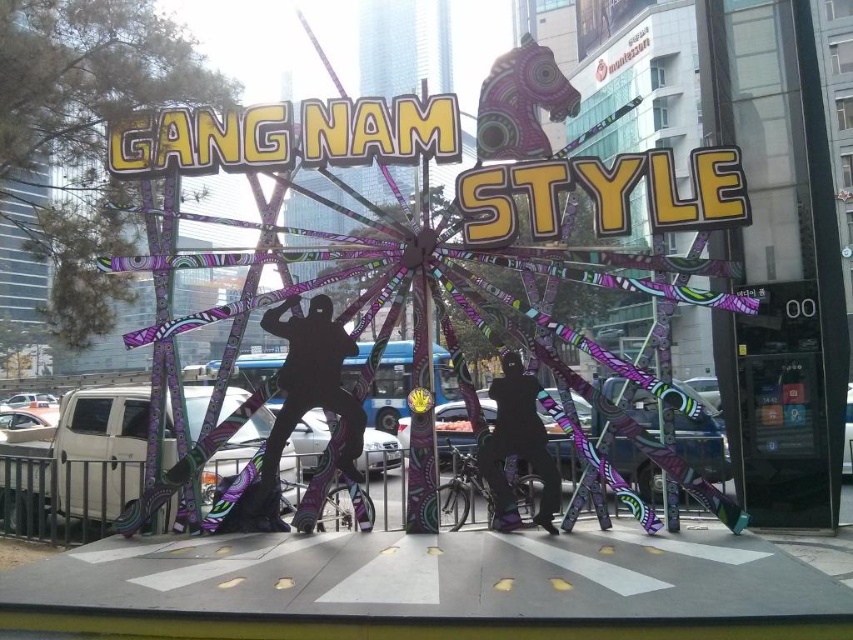
You are an artist planning to paint the scene from the front. Which object should you paint first to ensure proper layering, the black matte silhouette at center or the black matte pants at center?

You should paint the black matte silhouette at center first because the black matte pants at center is behind it, so painting the silhouette first allows the pants to be layered underneath.

You are an artist planning to paint a mural inspired by the installation. You need to know which object is wider between the black matte silhouette at center and the black matte pants at center to scale them correctly. Which one is wider?

The black matte silhouette at center is wider than the black matte pants at center according to the description.

Based on the scene description, where is the metallic purple ferris wheel at center located in terms of its 2D coordinates?

The metallic purple ferris wheel at center is located at the 2D coordinates of point (x=532, y=237).